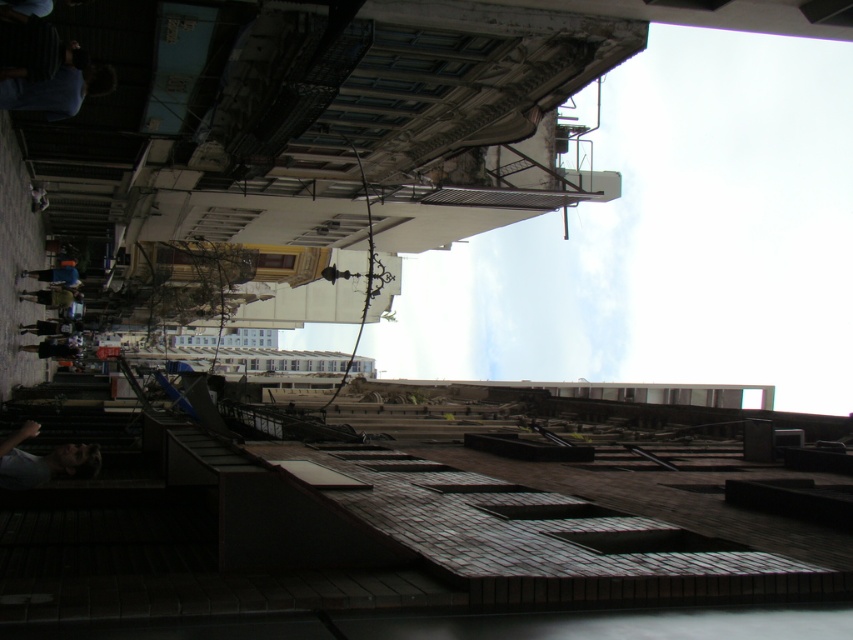
At what (x,y) coordinates should I click in order to perform the action: click on light blue fabric at lower left. Please return your answer as a coordinate pair (x, y). Image resolution: width=853 pixels, height=640 pixels. Looking at the image, I should click on (44, 460).

Between point (36, 465) and point (32, 269), which one is positioned in front?

Point (36, 465) is in front.

This screenshot has height=640, width=853. I want to click on light blue fabric at lower left, so click(44, 460).

Who is higher up, light blue fabric at lower left or light brown leather jacket at left?

light brown leather jacket at left

At what (x,y) coordinates should I click in order to perform the action: click on light blue fabric at lower left. Please return your answer as a coordinate pair (x, y). Looking at the image, I should click on (44, 460).

The image size is (853, 640). I want to click on light blue fabric at lower left, so click(x=44, y=460).

You are a GUI agent. You are given a task and a screenshot of the screen. Output one action in this format:
    pyautogui.click(x=<x>, y=<y>)
    Task: Click on the light blue fabric at lower left
    The image size is (853, 640).
    Given the screenshot: What is the action you would take?
    pyautogui.click(x=44, y=460)

Can you confirm if light brown leather jacket at left is taller than blue denim jacket at left?

No, light brown leather jacket at left is not taller than blue denim jacket at left.

Which is above, light brown leather jacket at left or blue denim jacket at left?

blue denim jacket at left is higher up.

Image resolution: width=853 pixels, height=640 pixels. What are the coordinates of `light brown leather jacket at left` in the screenshot? It's located at (x=55, y=298).

Locate an element on the screen. The width and height of the screenshot is (853, 640). light brown leather jacket at left is located at coordinates (55, 298).